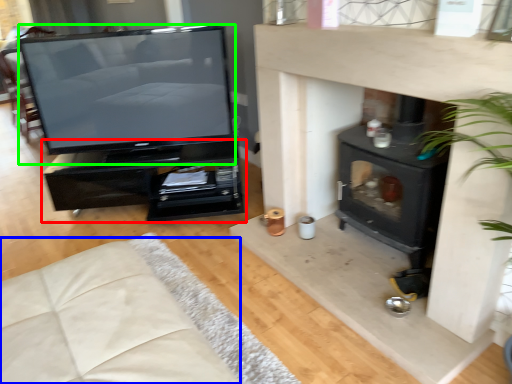
Question: Which object is the closest to the furniture (highlighted by a red box)? Choose among these: couch (highlighted by a blue box) or television (highlighted by a green box).

Choices:
 (A) couch
 (B) television

Answer: (B)